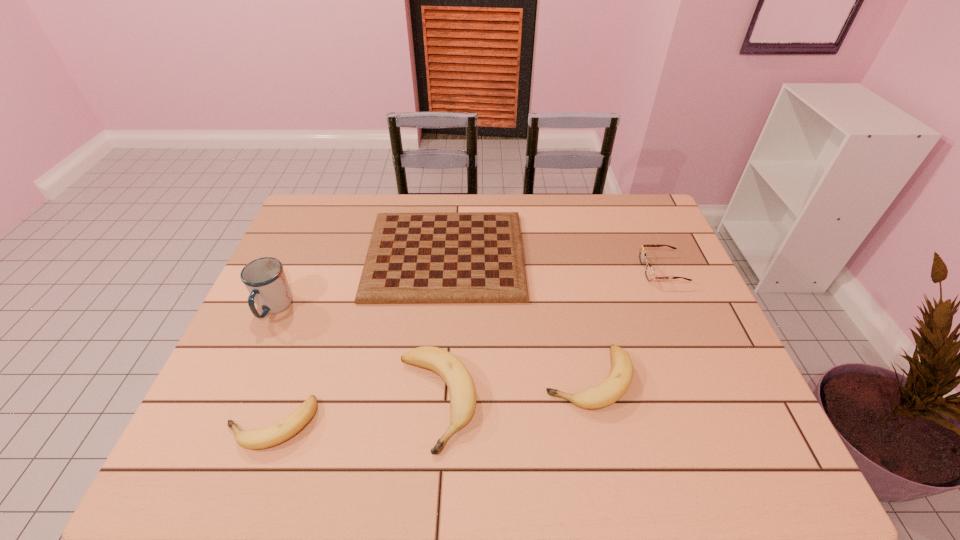
Find the location of a particular element. Image resolution: width=960 pixels, height=540 pixels. the leftmost banana is located at coordinates (254, 439).

This screenshot has width=960, height=540. I want to click on the second banana from left to right, so click(x=461, y=386).

What are the coordinates of `the rightmost banana` in the screenshot? It's located at (606, 393).

Where is `the second shortest banana`? This screenshot has height=540, width=960. the second shortest banana is located at coordinates (606, 393).

The height and width of the screenshot is (540, 960). Identify the location of the shortest object. (453, 257).

Where is `the rightmost object`? the rightmost object is located at coordinates (649, 273).

Where is `the tallest object`? Image resolution: width=960 pixels, height=540 pixels. the tallest object is located at coordinates (264, 278).

Find the location of `free space located 0.180m on the back of the shortest banana`. free space located 0.180m on the back of the shortest banana is located at coordinates (303, 337).

Where is `free spot located on the back of the second banana from right to left`? The width and height of the screenshot is (960, 540). free spot located on the back of the second banana from right to left is located at coordinates (444, 299).

This screenshot has width=960, height=540. Identify the location of free spot located 0.060m on the right of the second shortest banana. (658, 379).